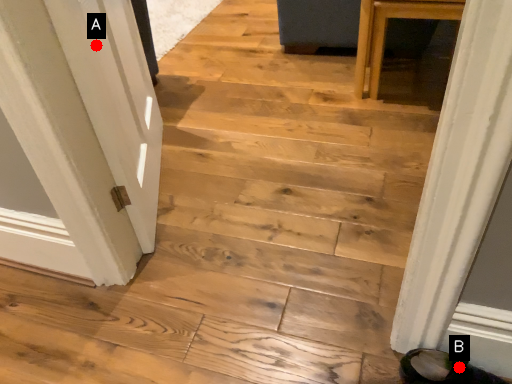
Question: Two points are circled on the image, labeled by A and B beside each circle. Which point is closer to the camera?

Choices:
 (A) A is closer
 (B) B is closer

Answer: (B)